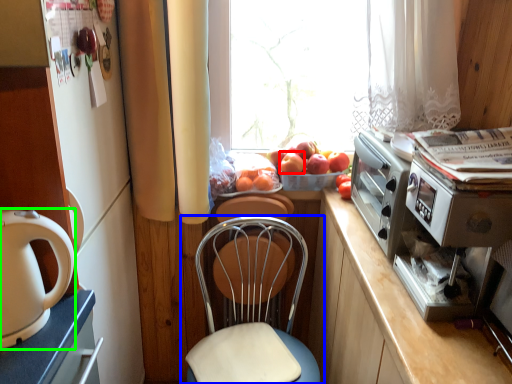
Question: Considering the real-world distances, which object is farthest from apple (highlighted by a red box)? chair (highlighted by a blue box) or home appliance (highlighted by a green box)?

Choices:
 (A) chair
 (B) home appliance

Answer: (B)